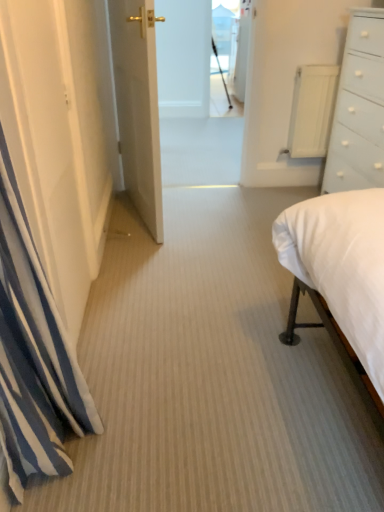
Where is `unoccupied region to the right of white striped curtain at left`? unoccupied region to the right of white striped curtain at left is located at coordinates (167, 443).